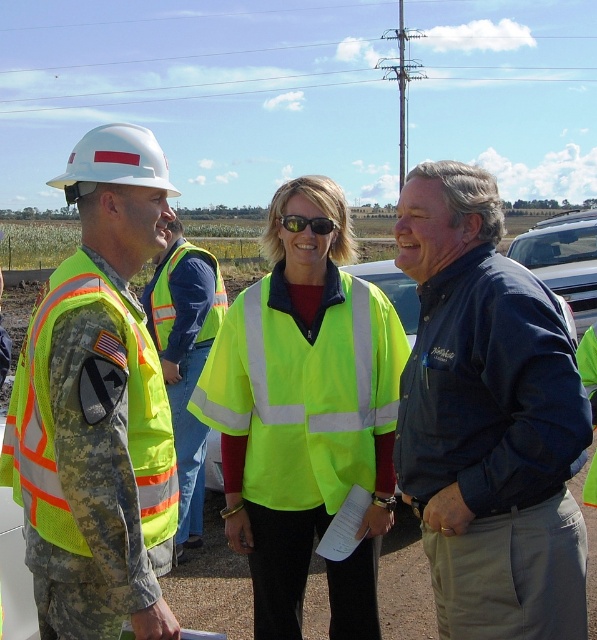
Does point (476, 572) come behind point (116, 129)?

No, (476, 572) is closer to viewer.

From the picture: Can you confirm if blue denim jacket at center is positioned above white hard hat at upper left?

No.

What do you see at coordinates (488, 419) in the screenshot? This screenshot has height=640, width=597. I see `blue denim jacket at center` at bounding box center [488, 419].

Where is `blue denim jacket at center`? blue denim jacket at center is located at coordinates (488, 419).

Who is more distant from viewer, (112, 172) or (315, 230)?

The point (315, 230) is more distant.

I want to click on white hard hat at upper left, so (115, 161).

Consider the image. Can you confirm if neon yellow reflective vest at center is positioned below white hard hat at upper left?

Yes, neon yellow reflective vest at center is below white hard hat at upper left.

Which is more to the right, neon yellow reflective vest at center or white hard hat at upper left?

neon yellow reflective vest at center is more to the right.

Is point (336, 472) in front of point (133, 148)?

No.

I want to click on neon yellow reflective vest at center, so click(x=306, y=416).